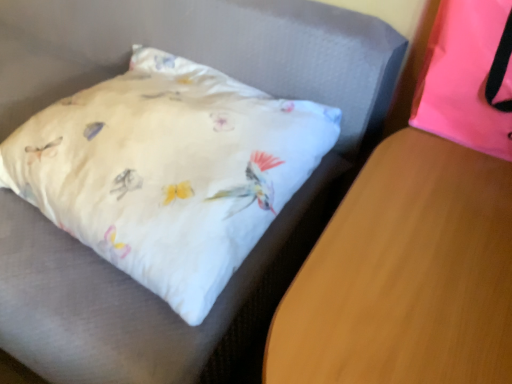
Measure the distance between wooden table at lower right and camera.

wooden table at lower right is 59.15 centimeters from camera.

Where is `wooden table at lower right`? The height and width of the screenshot is (384, 512). wooden table at lower right is located at coordinates (405, 275).

This screenshot has height=384, width=512. Describe the element at coordinates (405, 275) in the screenshot. I see `wooden table at lower right` at that location.

Describe the element at coordinates (468, 77) in the screenshot. The width and height of the screenshot is (512, 384). I see `pink fabric pillow at upper right` at that location.

Image resolution: width=512 pixels, height=384 pixels. Identify the location of pink fabric pillow at upper right. click(468, 77).

This screenshot has height=384, width=512. I want to click on wooden table at lower right, so 405,275.

Is wooden table at lower right to the left of pink fabric pillow at upper right from the viewer's perspective?

Indeed, wooden table at lower right is positioned on the left side of pink fabric pillow at upper right.

Between wooden table at lower right and pink fabric pillow at upper right, which one is positioned in front?

wooden table at lower right is closer to the camera.

Is point (475, 278) closer to camera compared to point (413, 124)?

Yes, it is.

From the image's perspective, is wooden table at lower right beneath pink fabric pillow at upper right?

Yes, from the image's perspective, wooden table at lower right is beneath pink fabric pillow at upper right.

From a real-world perspective, which object stands above the other?

From a 3D spatial view, pink fabric pillow at upper right is above.

Considering the sizes of objects wooden table at lower right and pink fabric pillow at upper right in the image provided, who is thinner, wooden table at lower right or pink fabric pillow at upper right?

With smaller width is pink fabric pillow at upper right.

Between wooden table at lower right and pink fabric pillow at upper right, which one has more height?

wooden table at lower right.

Which of these two, wooden table at lower right or pink fabric pillow at upper right, is bigger?

Bigger between the two is wooden table at lower right.

Based on the photo, choose the correct answer: Is wooden table at lower right inside pink fabric pillow at upper right or outside it?

wooden table at lower right cannot be found inside pink fabric pillow at upper right.

Is wooden table at lower right directly adjacent to pink fabric pillow at upper right?

No, wooden table at lower right is not in contact with pink fabric pillow at upper right.

Could you tell me if wooden table at lower right is facing pink fabric pillow at upper right?

No, wooden table at lower right is not oriented towards pink fabric pillow at upper right.

This screenshot has width=512, height=384. I want to click on pillow that is above the wooden table at lower right (from the image's perspective), so click(x=468, y=77).

From the picture: Is pink fabric pillow at upper right to the left or to the right of wooden table at lower right in the image?

Clearly, pink fabric pillow at upper right is on the right of wooden table at lower right in the image.

Is pink fabric pillow at upper right positioned behind wooden table at lower right?

Yes, it is.

Which is behind, point (510, 62) or point (273, 325)?

The point (510, 62) is farther from the camera.

From the image's perspective, is pink fabric pillow at upper right above or below wooden table at lower right?

Based on their image positions, pink fabric pillow at upper right is located above wooden table at lower right.

Based on the photo, from a real-world perspective, who is located lower, pink fabric pillow at upper right or wooden table at lower right?

In real-world perspective, wooden table at lower right is lower.

Consider the image. Which of these two, pink fabric pillow at upper right or wooden table at lower right, is wider?

wooden table at lower right.

Is pink fabric pillow at upper right shorter than wooden table at lower right?

Correct, pink fabric pillow at upper right is not as tall as wooden table at lower right.

Considering the sizes of objects pink fabric pillow at upper right and wooden table at lower right in the image provided, who is bigger, pink fabric pillow at upper right or wooden table at lower right?

wooden table at lower right.

Is pink fabric pillow at upper right spatially inside wooden table at lower right, or outside of it?

The correct answer is: outside.

Is pink fabric pillow at upper right not close to wooden table at lower right?

No, pink fabric pillow at upper right is not far from wooden table at lower right.

Is pink fabric pillow at upper right oriented away from wooden table at lower right?

That's not correct — pink fabric pillow at upper right is not looking away from wooden table at lower right.

Can you tell me how much pink fabric pillow at upper right and wooden table at lower right differ in facing direction?

The angular difference between pink fabric pillow at upper right and wooden table at lower right is 88.9 degrees.

At what (x,y) coordinates should I click in order to perform the action: click on pillow located above the wooden table at lower right (from the image's perspective). Please return your answer as a coordinate pair (x, y). Image resolution: width=512 pixels, height=384 pixels. Looking at the image, I should click on (468, 77).

The height and width of the screenshot is (384, 512). Identify the location of table below the pink fabric pillow at upper right (from a real-world perspective). (405, 275).

At what (x,y) coordinates should I click in order to perform the action: click on pillow above the wooden table at lower right (from a real-world perspective). Please return your answer as a coordinate pair (x, y). Looking at the image, I should click on (468, 77).